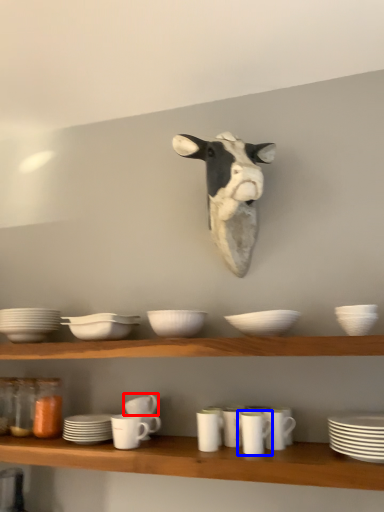
Question: Which object appears closest to the camera in this image, tableware (highlighted by a red box) or tableware (highlighted by a blue box)?

Choices:
 (A) tableware
 (B) tableware

Answer: (B)